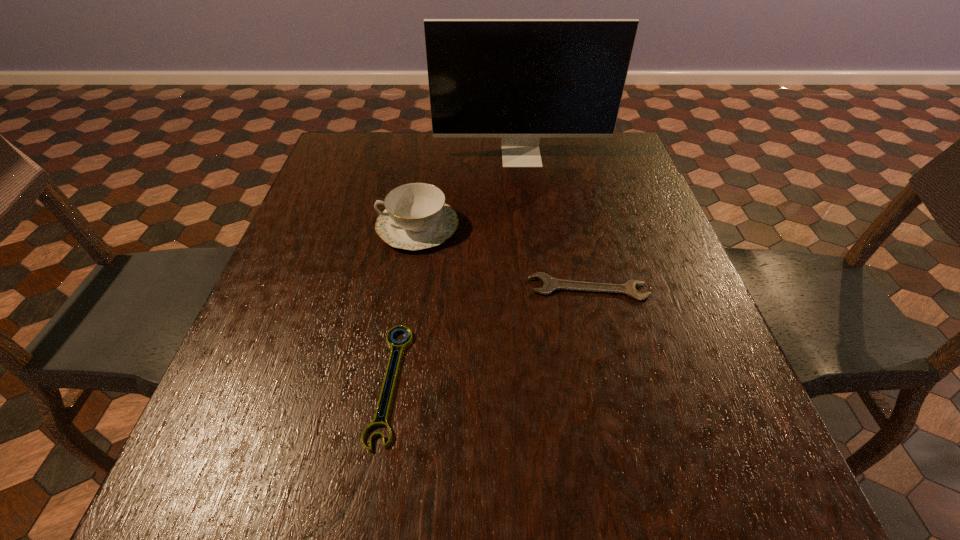
Where is `vacant space at the right edge`? The width and height of the screenshot is (960, 540). vacant space at the right edge is located at coordinates (689, 392).

In the image, there is a desktop. Find the location of `free space at the far right corner`. free space at the far right corner is located at coordinates (621, 143).

You are a GUI agent. You are given a task and a screenshot of the screen. Output one action in this format:
    pyautogui.click(x=<x>, y=<y>)
    Task: Click on the free point between the third tallest object and the tallest object
    The height and width of the screenshot is (540, 960).
    Given the screenshot: What is the action you would take?
    pyautogui.click(x=555, y=222)

Where is `vacant space that's between the left wrench and the second tallest object`? The image size is (960, 540). vacant space that's between the left wrench and the second tallest object is located at coordinates (404, 305).

Image resolution: width=960 pixels, height=540 pixels. What are the coordinates of `vacant space in between the farthest object and the third nearest object` in the screenshot? It's located at (469, 192).

At what (x,y) coordinates should I click in order to perform the action: click on unoccupied area between the chinaware and the shorter wrench. Please return your answer as a coordinate pair (x, y). This screenshot has height=540, width=960. Looking at the image, I should click on (404, 305).

Find the location of a particular element. This screenshot has width=960, height=540. vacant space that's between the second tallest object and the nearest object is located at coordinates (404, 305).

Locate an element on the screen. vacant space in between the tallest object and the second nearest object is located at coordinates (555, 222).

This screenshot has height=540, width=960. In order to click on free spot between the tallest object and the second tallest object in this screenshot , I will do [469, 192].

At what (x,y) coordinates should I click in order to perform the action: click on vacant space that is in between the nearest object and the third nearest object. Please return your answer as a coordinate pair (x, y). The image size is (960, 540). Looking at the image, I should click on (404, 305).